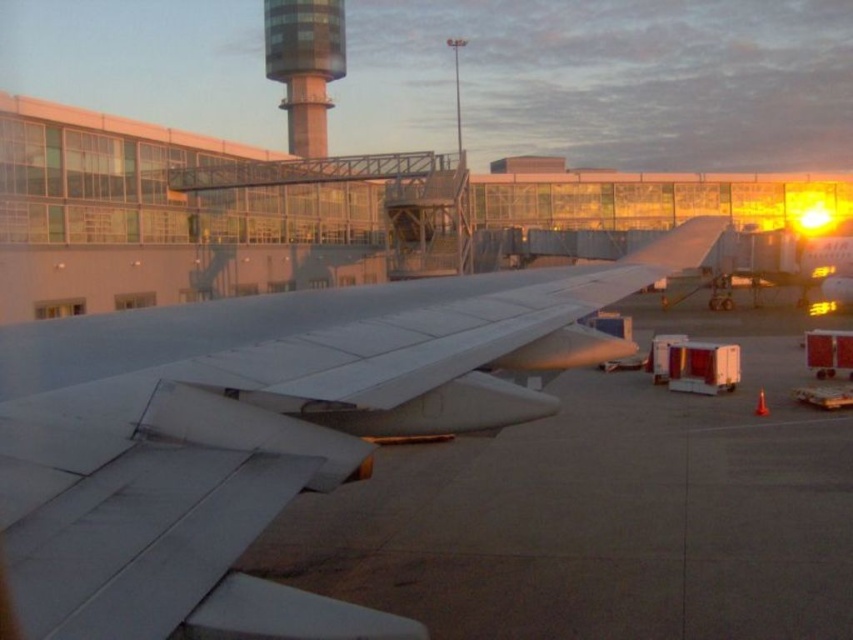
Question: Is glassy steel control tower at upper center below clear glass airplane window at center?

Choices:
 (A) yes
 (B) no

Answer: (B)

Question: Among these objects, which one is farthest from the camera?

Choices:
 (A) clear glass airplane window at center
 (B) glassy steel control tower at upper center

Answer: (B)

Question: Observing the image, what is the correct spatial positioning of white matte wing at center in reference to glassy steel control tower at upper center?

Choices:
 (A) below
 (B) above

Answer: (A)

Question: Which point is closer to the camera?

Choices:
 (A) white matte wing at center
 (B) clear glass airplane window at center
 (C) glassy steel control tower at upper center

Answer: (A)

Question: Does glassy steel control tower at upper center have a smaller size compared to clear glass airplane window at center?

Choices:
 (A) yes
 (B) no

Answer: (B)

Question: Which point is farther to the camera?

Choices:
 (A) (276, 38)
 (B) (57, 316)

Answer: (A)